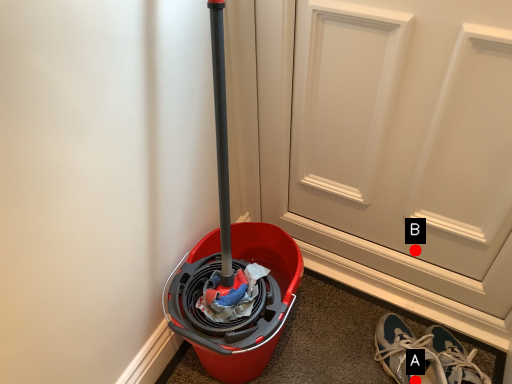
Question: Two points are circled on the image, labeled by A and B beside each circle. Among these points, which one is nearest to the camera?

Choices:
 (A) A is closer
 (B) B is closer

Answer: (A)